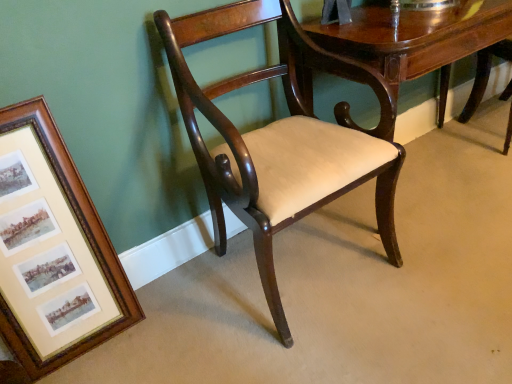
Where is `free location to the left of mahogany wood chair at center`? The height and width of the screenshot is (384, 512). free location to the left of mahogany wood chair at center is located at coordinates 177,314.